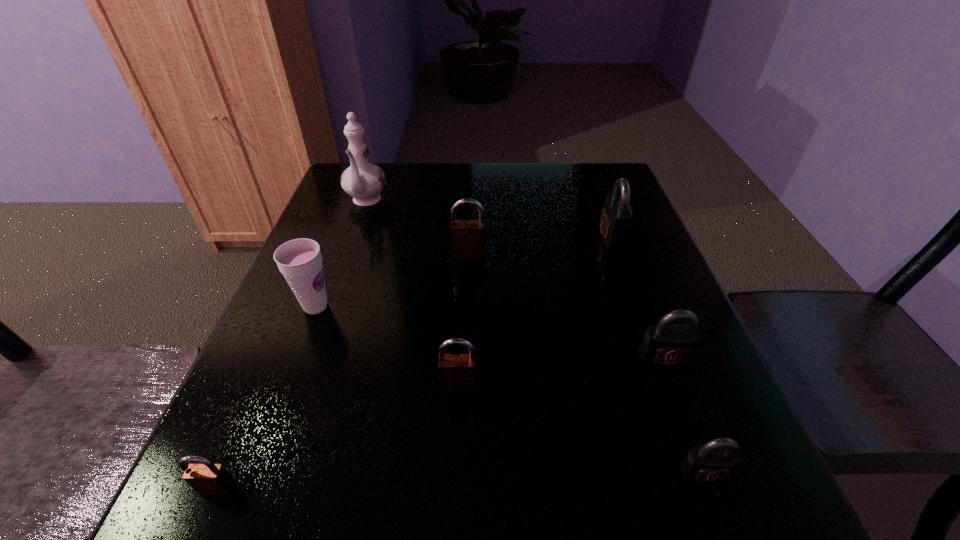
The width and height of the screenshot is (960, 540). In order to click on chinaware in this screenshot , I will do `click(364, 181)`.

Where is `the farthest object`? the farthest object is located at coordinates (364, 181).

This screenshot has width=960, height=540. Identify the location of the second farthest object. (616, 216).

Where is `the biggest gray padlock`? the biggest gray padlock is located at coordinates (616, 216).

You are a GUI agent. You are given a task and a screenshot of the screen. Output one action in this format:
    pyautogui.click(x=<x>, y=<y>)
    Task: Click on the farthest brown padlock
    
    Given the screenshot: What is the action you would take?
    pyautogui.click(x=467, y=236)

You are a GUI agent. You are given a task and a screenshot of the screen. Output one action in this format:
    pyautogui.click(x=<x>, y=<y>)
    Task: Click on the biggest brown padlock
    The image size is (960, 540).
    Given the screenshot: What is the action you would take?
    pyautogui.click(x=467, y=236)

Locate an element on the screen. the fourth farthest object is located at coordinates (300, 261).

Where is `cup`? The height and width of the screenshot is (540, 960). cup is located at coordinates (300, 261).

Locate an element on the screen. This screenshot has width=960, height=540. the second smallest brown padlock is located at coordinates click(457, 372).

This screenshot has width=960, height=540. I want to click on the fourth farthest padlock, so click(x=457, y=372).